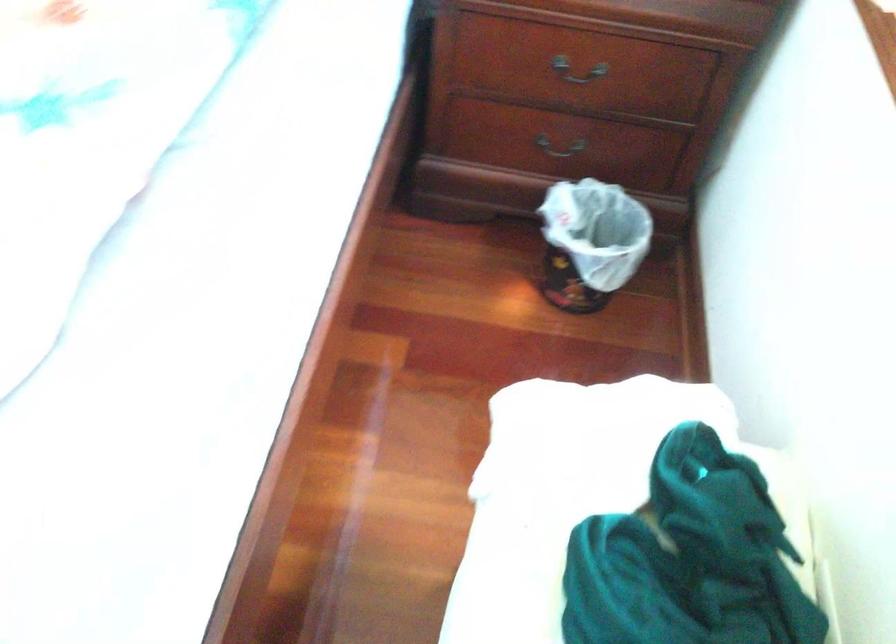
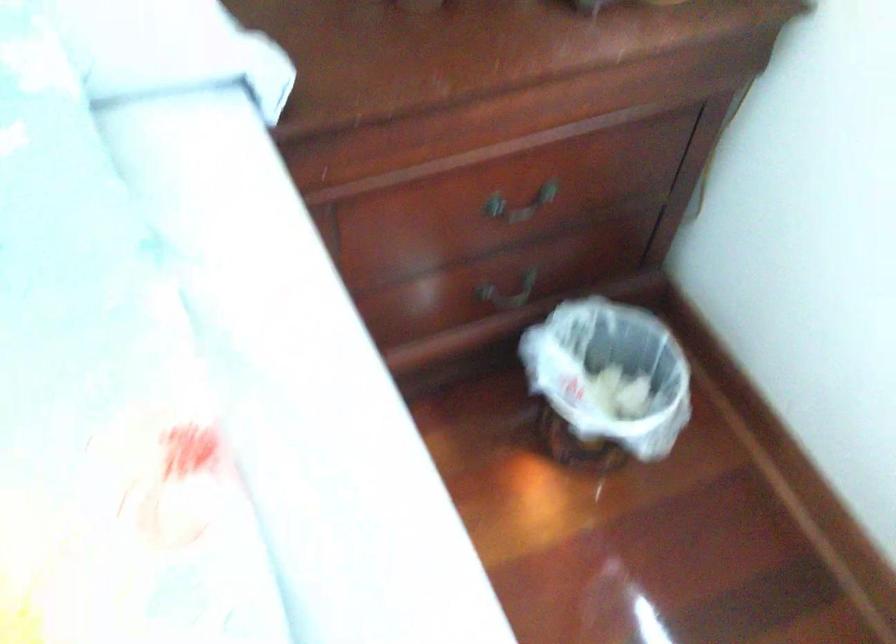
The point at (600, 251) is marked in the first image. Where is the corresponding point in the second image?

(606, 383)